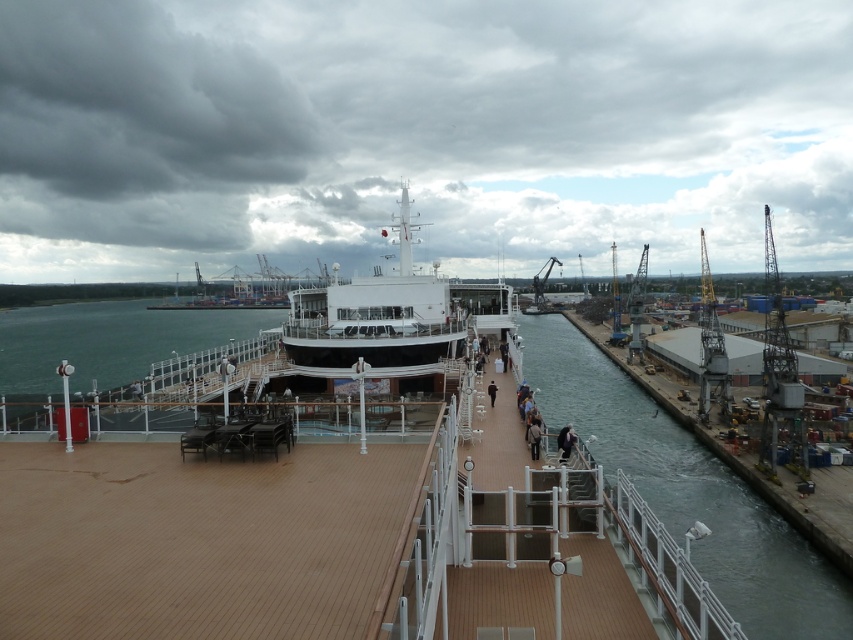
You are standing on the cruise ship deck and want to locate the clear water at dock right. According to the coordinates provided, where should you look relative to the deck?

The clear water at dock right is located at coordinates 0.767 on the x axis and 0.808 on the y axis relative to the deck.

In the scene shown: You are standing on the cruise ship deck and want to locate the dark blue fabric jacket at center. According to the coordinates provided, where would you look relative to the deck?

The dark blue fabric jacket at center is located at coordinates point 0.689 on the x axis and 0.665 on the y axis relative to the deck.

You are standing on the cruise ship deck and see two jackets hanging on a railing at the center. The jackets are a dark blue fabric jacket at center and a dark brown leather jacket at center. Which jacket takes up more space?

The dark blue fabric jacket at center is larger in size than the dark brown leather jacket at center, so it takes up more space.